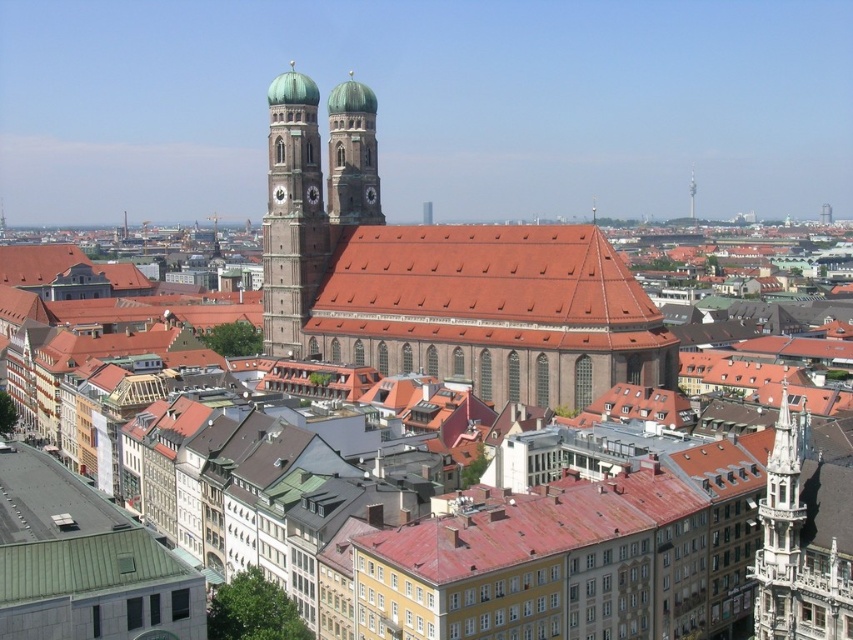
Question: Does matte brown clock tower at center-left appear under brown stone clock tower at center?

Choices:
 (A) yes
 (B) no

Answer: (A)

Question: Is matte brown clock tower at center-left positioned in front of brown stone clock tower at center?

Choices:
 (A) yes
 (B) no

Answer: (A)

Question: Which object is the farthest from the shiny silver spire at upper center?

Choices:
 (A) green metal roof at lower left
 (B) matte brown clock tower at center-left
 (C) matte gray clock at center

Answer: (A)

Question: Which of the following is the closest to the observer?

Choices:
 (A) (694, 216)
 (B) (45, 582)
 (C) (276, 204)

Answer: (B)

Question: Does shiny silver spire at upper center have a greater width compared to matte gray clock at center?

Choices:
 (A) yes
 (B) no

Answer: (A)

Question: Which is farther from the green metal roof at lower left?

Choices:
 (A) shiny silver spire at upper center
 (B) matte gray clock at center
 (C) matte brown clock tower at center-left
 (D) brown stone clock tower at center

Answer: (A)